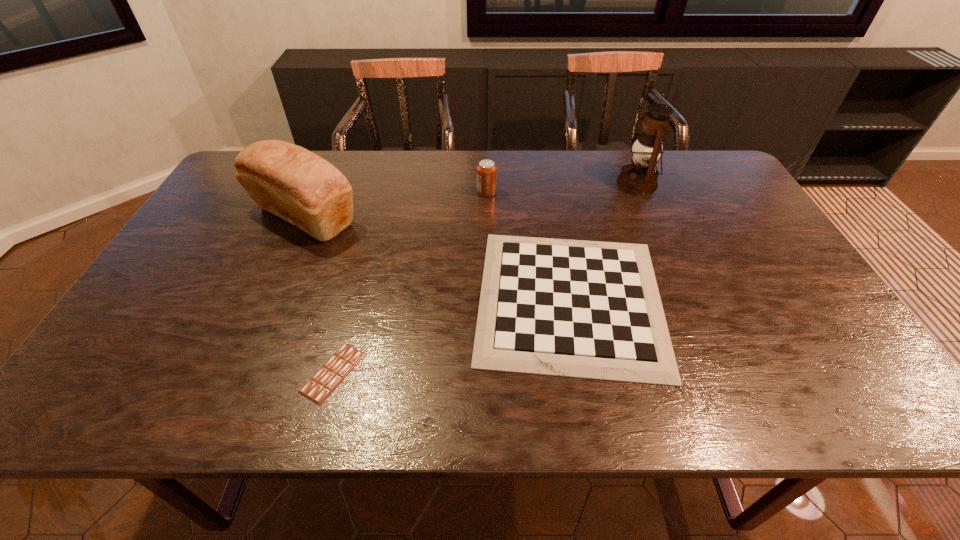
Find the location of a particular element. The height and width of the screenshot is (540, 960). free space located on the back of the fourth tallest object is located at coordinates (548, 181).

Locate an element on the screen. This screenshot has width=960, height=540. free space located 0.350m on the back of the chocolate bar is located at coordinates (369, 240).

Find the location of a particular element. This screenshot has width=960, height=540. lantern that is positioned at the far edge is located at coordinates (640, 177).

Where is `bread present at the far edge`? bread present at the far edge is located at coordinates (287, 180).

Find the location of a particular element. This screenshot has width=960, height=540. can located at the far edge is located at coordinates (486, 171).

The width and height of the screenshot is (960, 540). Find the location of `chessboard that is at the near edge`. chessboard that is at the near edge is located at coordinates (572, 308).

This screenshot has width=960, height=540. Identify the location of chocolate bar that is at the near edge. (329, 376).

The width and height of the screenshot is (960, 540). I want to click on object present at the left edge, so click(x=287, y=180).

This screenshot has height=540, width=960. I want to click on object situated at the far left corner, so click(287, 180).

You are a GUI agent. You are given a task and a screenshot of the screen. Output one action in this format:
    pyautogui.click(x=<x>, y=<y>)
    Task: Click on the blank space at the far edge of the desktop
    
    Given the screenshot: What is the action you would take?
    pyautogui.click(x=381, y=159)